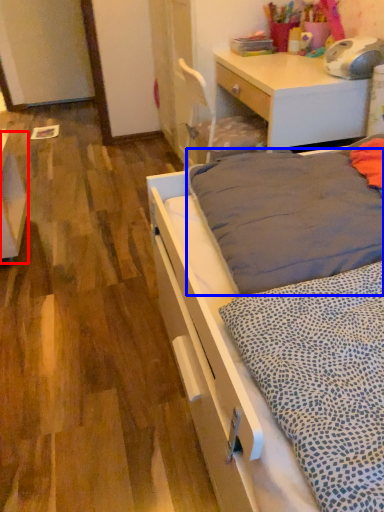
Question: Which of the following is the closest to the observer, vanity (highlighted by a red box) or mattress (highlighted by a blue box)?

Choices:
 (A) vanity
 (B) mattress

Answer: (B)